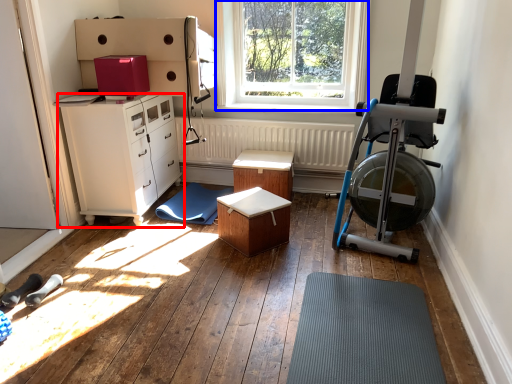
Question: Which of the following is the closest to the observer, chest of drawers (highlighted by a red box) or window (highlighted by a blue box)?

Choices:
 (A) chest of drawers
 (B) window

Answer: (A)